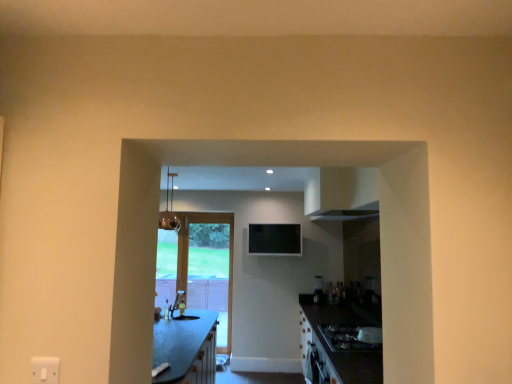
Question: Is the depth of wooden glass door at center greater than that of black glossy gas stove at lower right?

Choices:
 (A) no
 (B) yes

Answer: (B)

Question: From a real-world perspective, is wooden glass door at center on black glossy gas stove at lower right?

Choices:
 (A) yes
 (B) no

Answer: (A)

Question: From the image's perspective, is wooden glass door at center above black glossy gas stove at lower right?

Choices:
 (A) yes
 (B) no

Answer: (B)

Question: Would you say wooden glass door at center is outside black glossy gas stove at lower right?

Choices:
 (A) yes
 (B) no

Answer: (A)

Question: Is wooden glass door at center positioned far away from black glossy gas stove at lower right?

Choices:
 (A) yes
 (B) no

Answer: (A)

Question: Which is correct: black glossy gas stove at lower right is inside wooden glass door at center, or outside of it?

Choices:
 (A) inside
 (B) outside

Answer: (B)

Question: Is point (351, 337) closer or farther from the camera than point (198, 213)?

Choices:
 (A) closer
 (B) farther

Answer: (A)

Question: In the image, is black glossy gas stove at lower right positioned in front of or behind wooden glass door at center?

Choices:
 (A) front
 (B) behind

Answer: (A)

Question: Considering the positions of black glossy gas stove at lower right and wooden glass door at center in the image, is black glossy gas stove at lower right taller or shorter than wooden glass door at center?

Choices:
 (A) short
 (B) tall

Answer: (A)

Question: Considering the positions of black glossy gas stove at lower right and satin black blender at center in the image, is black glossy gas stove at lower right taller or shorter than satin black blender at center?

Choices:
 (A) short
 (B) tall

Answer: (A)

Question: Looking at the image, does black glossy gas stove at lower right seem bigger or smaller compared to satin black blender at center?

Choices:
 (A) big
 (B) small

Answer: (A)

Question: Considering the positions of black glossy gas stove at lower right and satin black blender at center in the image, is black glossy gas stove at lower right wider or thinner than satin black blender at center?

Choices:
 (A) wide
 (B) thin

Answer: (A)

Question: Is black glossy gas stove at lower right in front of or behind satin black blender at center in the image?

Choices:
 (A) behind
 (B) front

Answer: (B)

Question: From a real-world perspective, is wooden glass door at center above or below matte white sink at center?

Choices:
 (A) below
 (B) above

Answer: (B)

Question: Does point (224, 332) appear closer or farther from the camera than point (170, 314)?

Choices:
 (A) farther
 (B) closer

Answer: (A)